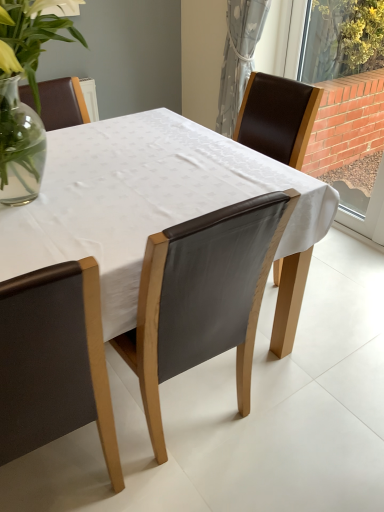
Locate an element on the screen. This screenshot has width=384, height=512. vacant area that is situated to the right of leather at center, which appears as the second chair when viewed from the left is located at coordinates click(292, 429).